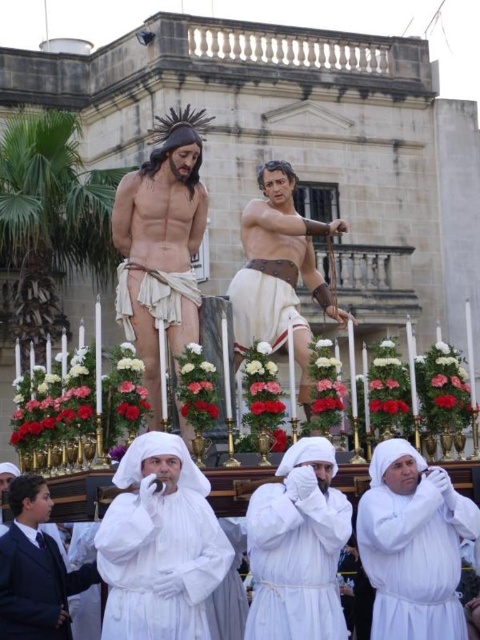
Between matte wooden statue at center and smooth white statue at center, which one is positioned higher?

matte wooden statue at center is above.

Consider the image. Can you confirm if matte wooden statue at center is positioned to the left of smooth white statue at center?

Yes, matte wooden statue at center is to the left of smooth white statue at center.

What do you see at coordinates (160, 244) in the screenshot? The image size is (480, 640). I see `matte wooden statue at center` at bounding box center [160, 244].

Where is `matte wooden statue at center`? matte wooden statue at center is located at coordinates (160, 244).

Consider the image. Measure the distance from smooth white statue at center to white cotton robe at lower center.

9.02 meters

Is smooth white statue at center taller than white cotton robe at lower center?

Yes, smooth white statue at center is taller than white cotton robe at lower center.

This screenshot has height=640, width=480. Describe the element at coordinates (278, 273) in the screenshot. I see `smooth white statue at center` at that location.

This screenshot has height=640, width=480. In order to click on smooth white statue at center in this screenshot , I will do `click(278, 273)`.

You are a GUI agent. You are given a task and a screenshot of the screen. Output one action in this format:
    pyautogui.click(x=<x>, y=<y>)
    Task: Click on the white cloth at center
    
    Given the screenshot: What is the action you would take?
    pyautogui.click(x=159, y=545)

Who is more distant from viewer, (156, 611) or (327, 618)?

The point (327, 618) is more distant.

Measure the distance between point [172,616] and camera.

32.41 meters

The height and width of the screenshot is (640, 480). I want to click on white cloth at center, so (x=159, y=545).